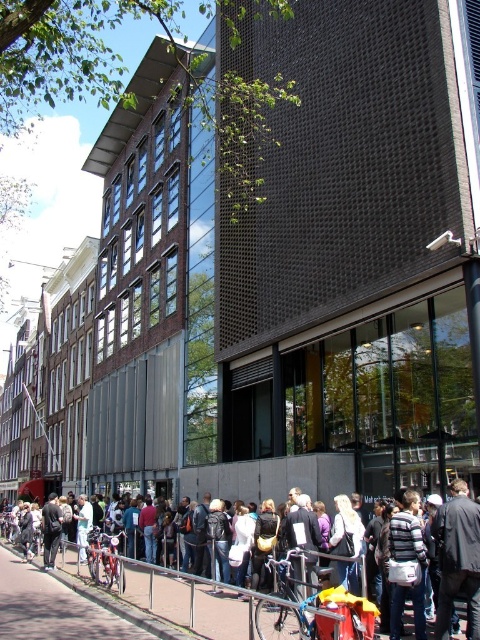
Does point (260, 596) come in front of point (156, 621)?

Yes, it is in front of point (156, 621).

Does white cotton shirt at center appear over concrete pavement at lower center?

Yes, white cotton shirt at center is above concrete pavement at lower center.

Measure the distance between white cotton shirt at center and camera.

A distance of 16.96 meters exists between white cotton shirt at center and camera.

Find the location of a particular element. The width and height of the screenshot is (480, 640). white cotton shirt at center is located at coordinates (304, 616).